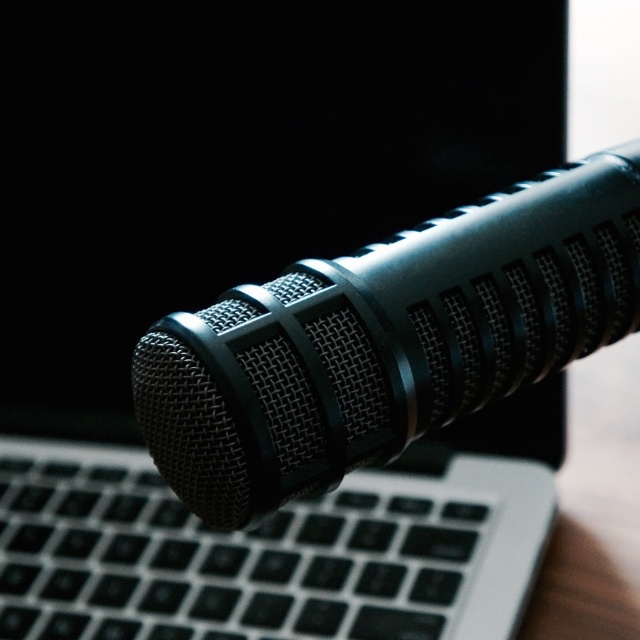
Between black matte microphone at center and black matte keyboard at center, which one has more height?

Standing taller between the two is black matte microphone at center.

Describe the element at coordinates (387, 340) in the screenshot. I see `black matte microphone at center` at that location.

Identify the location of black matte microphone at center. (387, 340).